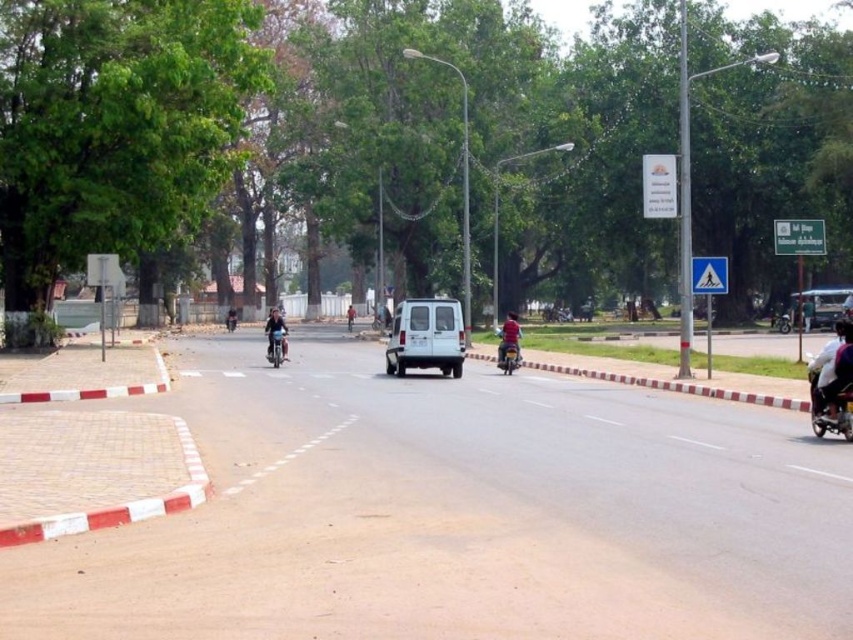
You are a delivery driver navigating an urban route. Your GPS shows that you need to turn left at the next intersection. You see a metallic silver van at center in your path. Based on its position, can you safely make the turn without obstructing the van?

The metallic silver van at center is positioned at point [822,307], which is near the center of the road and close to the bottom edge of the frame. Since it is in the middle of the road, you should wait until the van passes before attempting the left turn to avoid obstructing its path.

You are a delivery driver on the road and need to pass the red glossy motorcycle at center. There is a white fabric shirt at right walking on the sidewalk. Which direction should you turn to safely avoid both the motorcycle and the pedestrian?

Since the white fabric shirt at right is to the right of the red glossy motorcycle at center, you should turn left to safely avoid both the motorcycle and the pedestrian while staying within the road lanes.